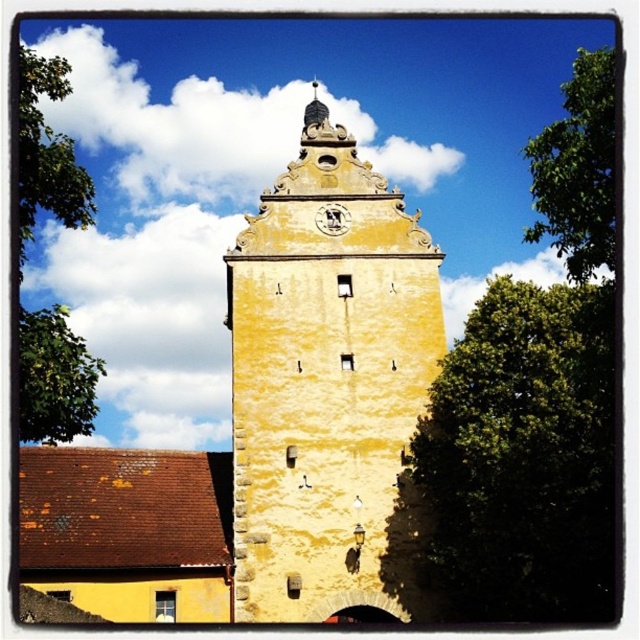
Which of these two, green leafy tree at upper left or green leafy tree at left, stands shorter?

With less height is green leafy tree at left.

Which is more to the right, green leafy tree at upper left or green leafy tree at left?

From the viewer's perspective, green leafy tree at left appears more on the right side.

Locate an element on the screen. Image resolution: width=640 pixels, height=640 pixels. green leafy tree at upper left is located at coordinates (48, 152).

Can you confirm if yellow stone tower at center is smaller than gold textured clock at upper center?

Actually, yellow stone tower at center might be larger than gold textured clock at upper center.

Who is more distant from viewer, [339,476] or [323,218]?

The point [323,218] is behind.

Identify the location of yellow stone tower at center. This screenshot has width=640, height=640. (324, 380).

Does green leafy tree at upper right have a smaller size compared to green leafy tree at left?

No.

Describe the element at coordinates (579, 170) in the screenshot. Image resolution: width=640 pixels, height=640 pixels. I see `green leafy tree at upper right` at that location.

Which is in front, point (580, 72) or point (83, 380)?

Point (83, 380) is in front.

Identify the location of green leafy tree at upper right. This screenshot has height=640, width=640. (579, 170).